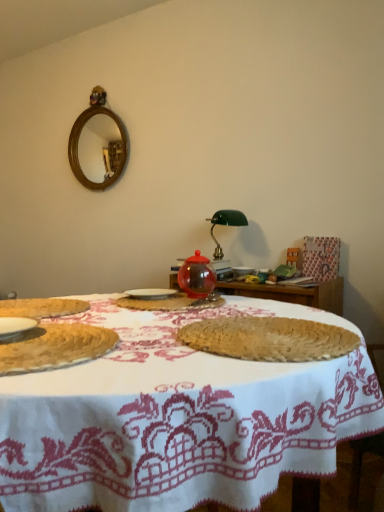
Question: Does white ceramic plate at center have a larger size compared to transparent glass jar at center, which appears as the first food when viewed from the back?

Choices:
 (A) no
 (B) yes

Answer: (A)

Question: Is the position of white ceramic plate at center less distant than that of transparent glass jar at center, which appears as the first food when viewed from the back?

Choices:
 (A) yes
 (B) no

Answer: (B)

Question: From a real-world perspective, is white ceramic plate at center located beneath transparent glass jar at center, which is the 3th food in front-to-back order?

Choices:
 (A) yes
 (B) no

Answer: (B)

Question: Is white ceramic plate at center taller than transparent glass jar at center, which is the 3th food in front-to-back order?

Choices:
 (A) yes
 (B) no

Answer: (A)

Question: Is white ceramic plate at center smaller than transparent glass jar at center, which appears as the first food when viewed from the back?

Choices:
 (A) yes
 (B) no

Answer: (A)

Question: Based on their sizes in the image, would you say white ceramic plate at center is bigger or smaller than transparent glass jar at center, which is the 3th food in front-to-back order?

Choices:
 (A) small
 (B) big

Answer: (A)

Question: From the image's perspective, is white ceramic plate at center above or below transparent glass jar at center, which is the 3th food in front-to-back order?

Choices:
 (A) below
 (B) above

Answer: (B)

Question: Would you say white ceramic plate at center is inside or outside transparent glass jar at center, which appears as the first food when viewed from the back?

Choices:
 (A) inside
 (B) outside

Answer: (A)

Question: Looking at their shapes, would you say white ceramic plate at center is wider or thinner than transparent glass jar at center, which is the 3th food in front-to-back order?

Choices:
 (A) wide
 (B) thin

Answer: (B)

Question: Considering the positions of white woven placemat at center and green glass table lamp at center in the image, is white woven placemat at center taller or shorter than green glass table lamp at center?

Choices:
 (A) tall
 (B) short

Answer: (B)

Question: Visually, is white woven placemat at center positioned to the left or to the right of green glass table lamp at center?

Choices:
 (A) left
 (B) right

Answer: (A)

Question: Considering the positions of white woven placemat at center and green glass table lamp at center in the image, is white woven placemat at center bigger or smaller than green glass table lamp at center?

Choices:
 (A) big
 (B) small

Answer: (A)

Question: In terms of width, does white woven placemat at center look wider or thinner when compared to green glass table lamp at center?

Choices:
 (A) thin
 (B) wide

Answer: (B)

Question: From the image's perspective, is bread at left, which is the 1th food in front-to-back order, positioned above or below transparent glass jar at center, which appears as the first food when viewed from the back?

Choices:
 (A) above
 (B) below

Answer: (B)

Question: Is bread at left, which is the 1th food in front-to-back order, bigger or smaller than transparent glass jar at center, which is the 3th food in front-to-back order?

Choices:
 (A) big
 (B) small

Answer: (A)